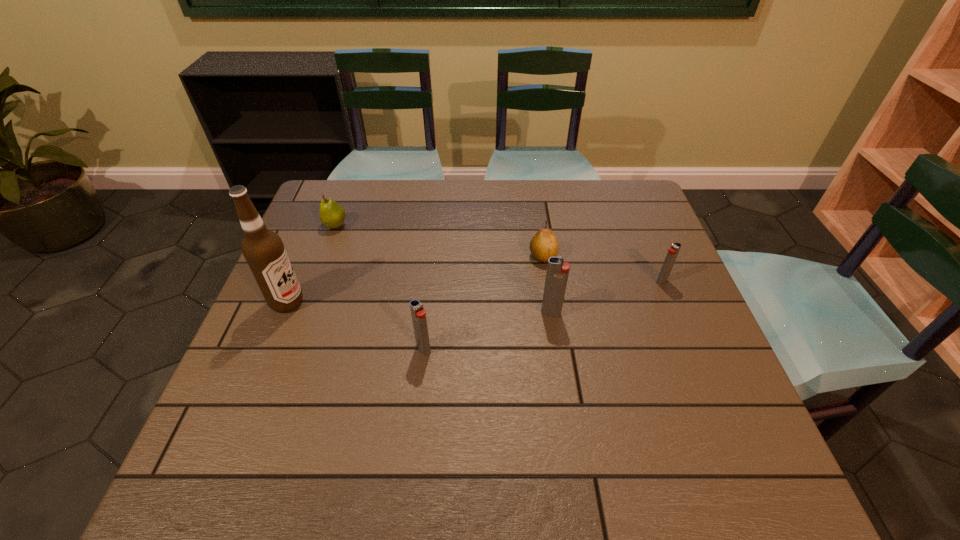
Find the location of `vacant space located 0.150m on the back of the third tallest object`. vacant space located 0.150m on the back of the third tallest object is located at coordinates (430, 294).

Identify the location of vacant area situated 0.280m on the back of the second igniter from left to right. The width and height of the screenshot is (960, 540). (540, 235).

At what (x,y) coordinates should I click in order to perform the action: click on free space located 0.250m on the back of the rightmost igniter. Please return your answer as a coordinate pair (x, y). Looking at the image, I should click on (636, 219).

Identify the location of vacant space located 0.050m on the front of the farther pear. This screenshot has height=540, width=960. (328, 245).

The width and height of the screenshot is (960, 540). I want to click on vacant space located 0.100m on the front of the right pear, so click(x=548, y=293).

I want to click on vacant space situated on the label of the tallest object, so click(341, 302).

Find the location of a particular element. Image resolution: width=960 pixels, height=540 pixels. object situated at the far edge is located at coordinates (332, 215).

The image size is (960, 540). Identify the location of pear present at the left edge. (332, 215).

The height and width of the screenshot is (540, 960). Identify the location of alcohol that is at the left edge. (263, 249).

Locate an element on the screen. The height and width of the screenshot is (540, 960). object present at the right edge is located at coordinates (673, 251).